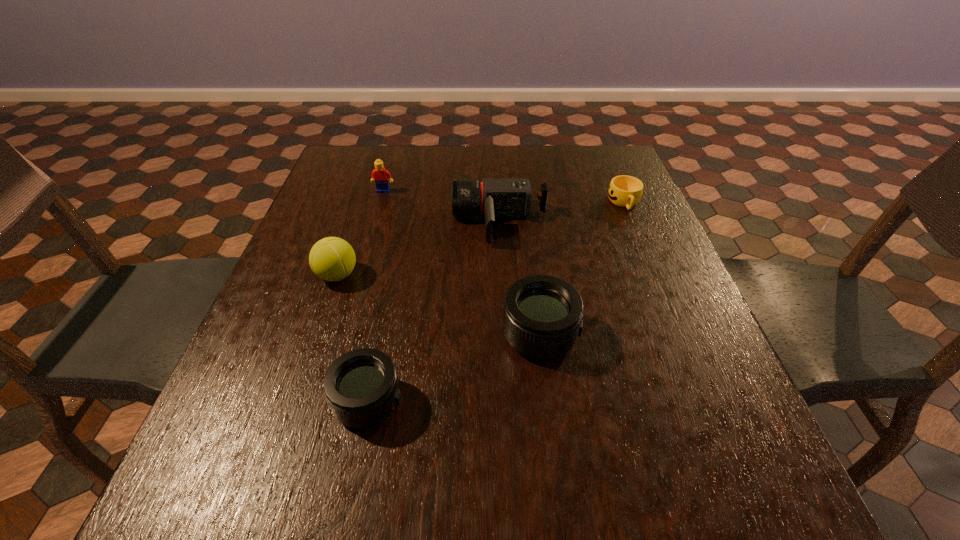
Find the location of a particular element. The image size is (960, 540). object located at the right edge is located at coordinates [x=624, y=191].

This screenshot has height=540, width=960. Find the location of `blank space at the far edge of the desktop`. blank space at the far edge of the desktop is located at coordinates (392, 174).

At what (x,y) coordinates should I click in order to perform the action: click on blank space at the near edge. Please return your answer as a coordinate pair (x, y). This screenshot has width=960, height=540. Looking at the image, I should click on (420, 444).

You are a GUI agent. You are given a task and a screenshot of the screen. Output one action in this format:
    pyautogui.click(x=<x>, y=<y>)
    Task: Click on the blank space at the left edge
    
    Given the screenshot: What is the action you would take?
    pyautogui.click(x=302, y=228)

The width and height of the screenshot is (960, 540). Find the location of `vacant space at the right edge`. vacant space at the right edge is located at coordinates (662, 287).

Locate an element on the screen. free region at the far left corner of the desktop is located at coordinates (369, 174).

Find the location of a particular element. free space at the far right corner of the desktop is located at coordinates (588, 186).

Find the location of a particular element. This screenshot has height=540, width=960. free space at the near right corner is located at coordinates (737, 430).

This screenshot has height=540, width=960. What are the coordinates of `empty space that is in between the shorter telephoto lens and the rightmost object` in the screenshot? It's located at (496, 302).

Locate an element on the screen. blank region between the right telephoto lens and the fourth farthest object is located at coordinates (439, 305).